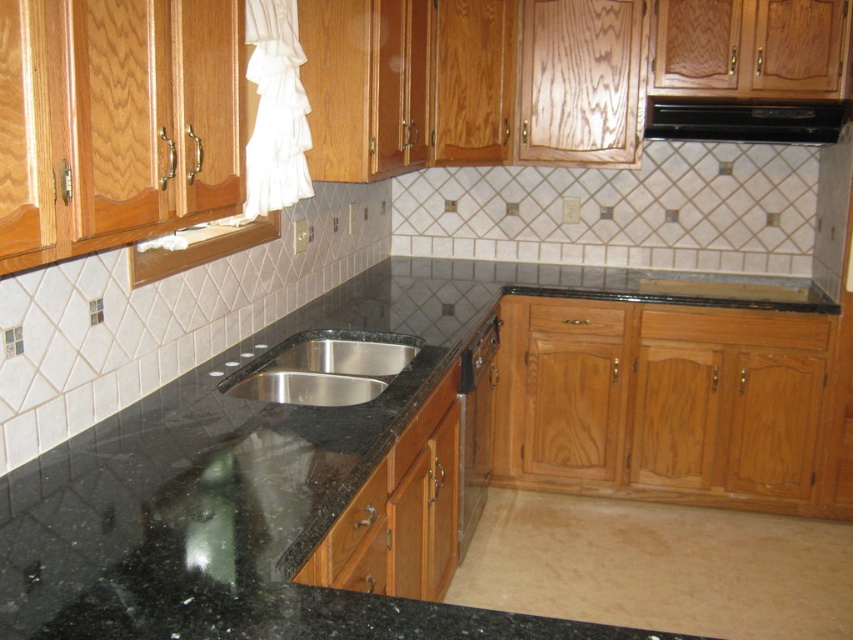
Based on the photo, you are a kitchen designer assessing the layout. You need to place a new appliance that requires 1.2 meters of width. The stainless steel sink at center and the black matte exhaust hood at upper right are already present. Which object has enough space to accommodate the appliance next to it?

The stainless steel sink at center has a larger size compared to the black matte exhaust hood at upper right, so it likely has more space around it to accommodate the appliance requiring 1.2 meters of width.

You are a plumber working on the kitchen sink. You need to place a tool on the counter next to the sink. Given the sizes of the black granite countertop at center and the stainless steel sink at center, will there be enough space on the counter for the tool?

The black granite countertop at center has a larger size compared to the stainless steel sink at center, so there should be sufficient space on the counter next to the sink to place the tool.

You are standing in the kitchen and want to place a cutting board on the black granite countertop at center. Given that the point you are currently facing is at coordinates point [267,452], can you confirm if this point is on the black granite countertop at center?

Yes, the point [267,452] corresponds to the black granite countertop at center, so placing the cutting board there is appropriate.